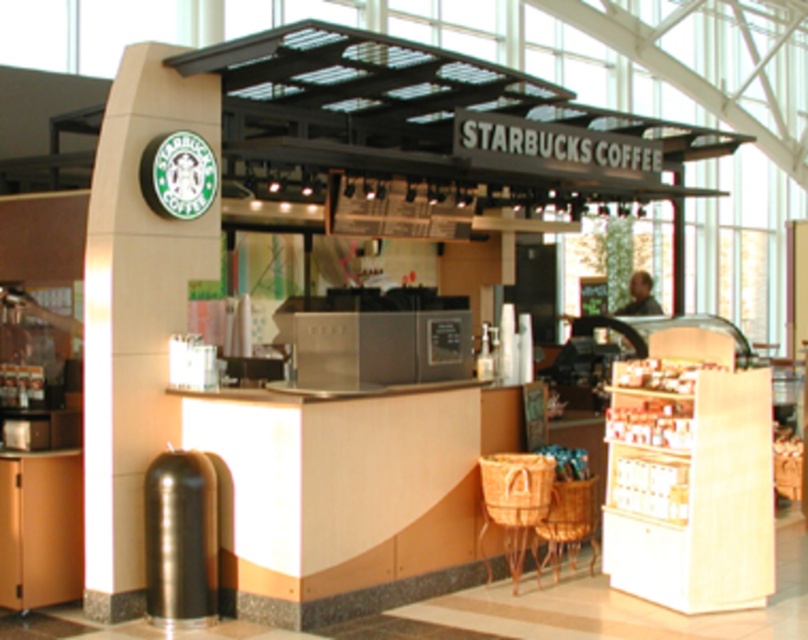
You are standing at the entrance of the Starbucks kiosk and want to throw away a piece of trash. The trash can is located at point (135, 314). Can you confirm if the trash can is on the left side of the kiosk?

Yes, the trash can at point (135, 314) is on the left side of the kiosk as indicated by its position relative to the Starbucks branding on the left side of the kiosk.

You are a customer at the Starbucks kiosk and want to dispose of your empty cup. The trash can is to your left, but you also see a chair nearby. Which object is larger in size between the metallic cylindrical trash can at left and the woven wood chair at lower center?

The metallic cylindrical trash can at left is bigger than the woven wood chair at lower center, so the trash can is larger in size.

You are a barista working at the Starbucks kiosk. You need to place a customer order on the counter. The customer wants their coffee placed between the metallic cylindrical trash can at left and the brown woven basket at lower right. Can you fit the coffee there?

The metallic cylindrical trash can at left and brown woven basket at lower right are 3.18 meters apart, so yes, there is enough space between them to place the coffee order.